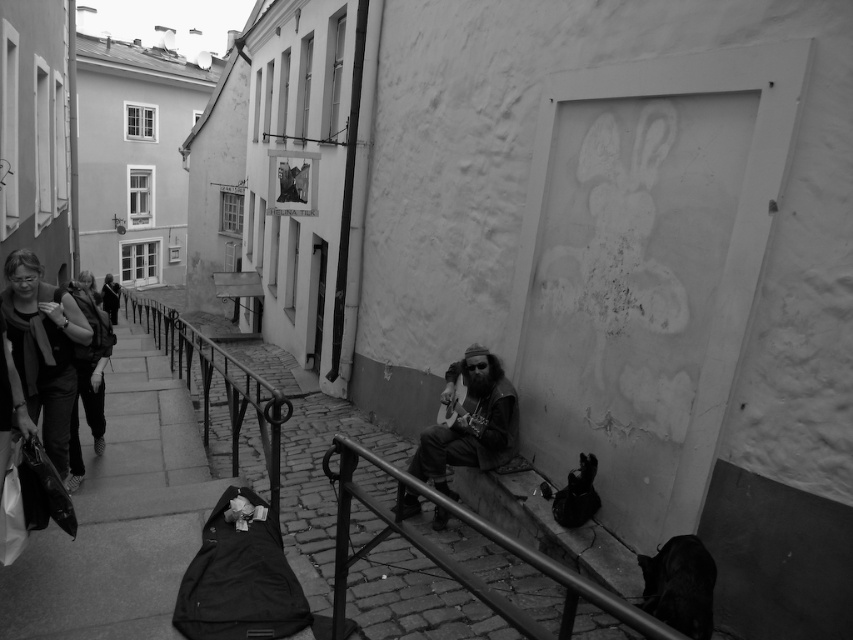
Question: Which object is closer to the camera taking this photo?

Choices:
 (A) smooth metal railing at lower center
 (B) metallic rail at lower center
 (C) matte black jacket at left

Answer: (B)

Question: Can you confirm if matte black jacket at left is positioned to the right of dark brown leather guitar at center?

Choices:
 (A) yes
 (B) no

Answer: (B)

Question: Is smooth metal railing at lower center smaller than matte black jacket at left?

Choices:
 (A) no
 (B) yes

Answer: (A)

Question: Based on their relative distances, which object is farther from the smooth metal railing at lower center?

Choices:
 (A) matte black jacket at left
 (B) dark brown leather guitar at center
 (C) matte black backpack at left

Answer: (C)

Question: Is smooth metal railing at lower center positioned in front of matte black jacket at left?

Choices:
 (A) yes
 (B) no

Answer: (A)

Question: Which is farther from the matte black backpack at left?

Choices:
 (A) smooth metal railing at lower center
 (B) dark brown leather guitar at center

Answer: (B)